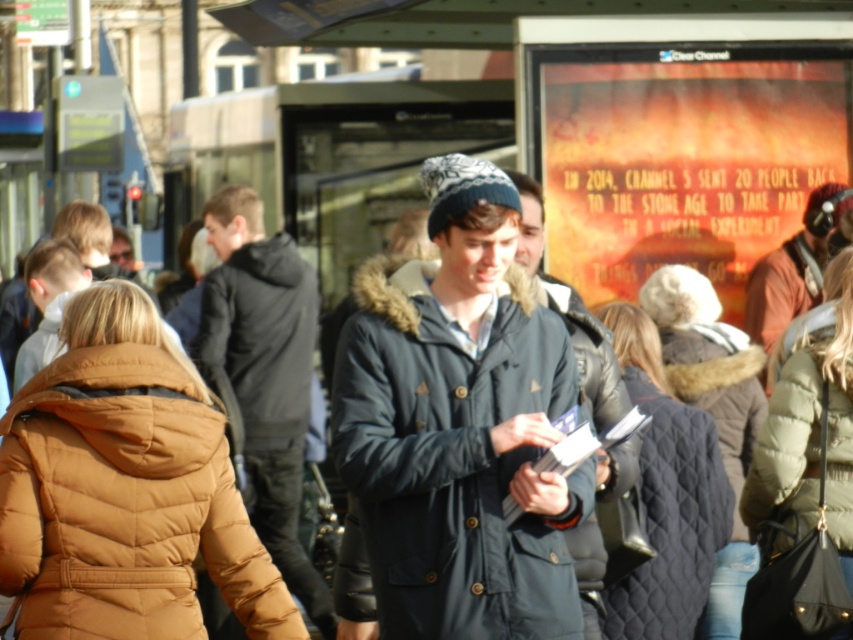
You are a pedestrian walking through the area and notice the orange fabric poster at upper right and the dark blue jacket at center. Which object is positioned higher in the scene?

The orange fabric poster at upper right is positioned higher than the dark blue jacket at center in the scene.

You are a photographer standing at the bus stop and want to take a photo of both the quilted black jacket at center and the brown quilted jacket at center. Which jacket should you focus on first to ensure both are in clear view?

You should focus on the quilted black jacket at center first because it is closer to you than the brown quilted jacket at center. By focusing on the closer jacket, both will be in clear view due to the depth of field.

You are standing at the bus stop and want to read the text on the orange fabric poster at upper right. However, there is a person wearing a black quilted jacket at center blocking your view. Can you see the poster without moving your head?

The orange fabric poster at upper right is further to the viewer than the black quilted jacket at center, so the poster is closer to you and not blocked by the jacket. You can see the poster without moving your head.